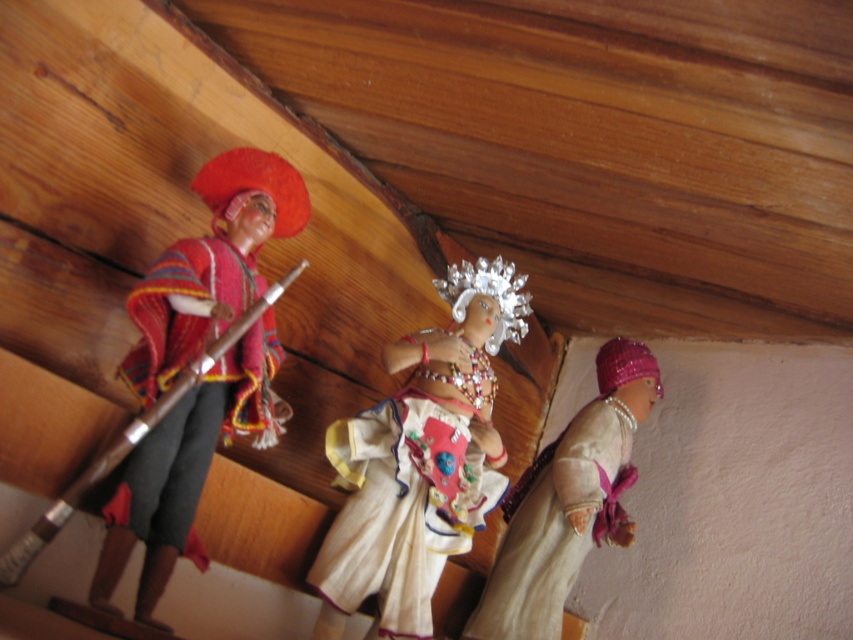
Question: Which point is closer to the camera?

Choices:
 (A) (155, 289)
 (B) (374, 584)
 (C) (552, 604)

Answer: (A)

Question: Can you confirm if beige fabric skirt at lower right is positioned below knitted woolen poncho at left?

Choices:
 (A) yes
 (B) no

Answer: (A)

Question: Based on their relative distances, which object is nearer to the white fabric doll at center?

Choices:
 (A) beige fabric skirt at lower right
 (B) knitted woolen poncho at left

Answer: (A)

Question: Which of the following is the closest to the observer?

Choices:
 (A) (585, 465)
 (B) (456, 435)
 (C) (128, 356)

Answer: (C)

Question: Where is beige fabric skirt at lower right located in relation to knitted woolen poncho at left in the image?

Choices:
 (A) left
 (B) right

Answer: (B)

Question: Is beige fabric skirt at lower right positioned at the back of knitted woolen poncho at left?

Choices:
 (A) yes
 (B) no

Answer: (A)